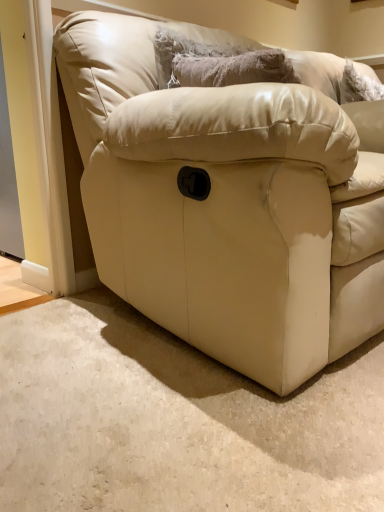
Question: From a real-world perspective, is fuzzy gray pillow at upper center above or below matte leather couch at center?

Choices:
 (A) above
 (B) below

Answer: (A)

Question: Is fuzzy gray pillow at upper center to the left or to the right of matte leather couch at center in the image?

Choices:
 (A) left
 (B) right

Answer: (A)

Question: Is fuzzy gray pillow at upper center bigger or smaller than matte leather couch at center?

Choices:
 (A) small
 (B) big

Answer: (A)

Question: Would you say matte leather couch at center is to the left or to the right of fuzzy gray pillow at upper center in the picture?

Choices:
 (A) right
 (B) left

Answer: (A)

Question: Considering their positions, is matte leather couch at center located in front of or behind fuzzy gray pillow at upper center?

Choices:
 (A) behind
 (B) front

Answer: (B)

Question: Choose the correct answer: Is matte leather couch at center inside fuzzy gray pillow at upper center or outside it?

Choices:
 (A) outside
 (B) inside

Answer: (A)

Question: From their relative heights in the image, would you say matte leather couch at center is taller or shorter than fuzzy gray pillow at upper center?

Choices:
 (A) short
 (B) tall

Answer: (B)